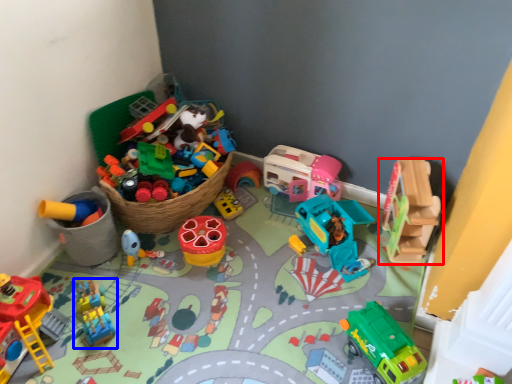
Question: Which point is further to the camera, toy (highlighted by a red box) or toy (highlighted by a blue box)?

Choices:
 (A) toy
 (B) toy

Answer: (A)